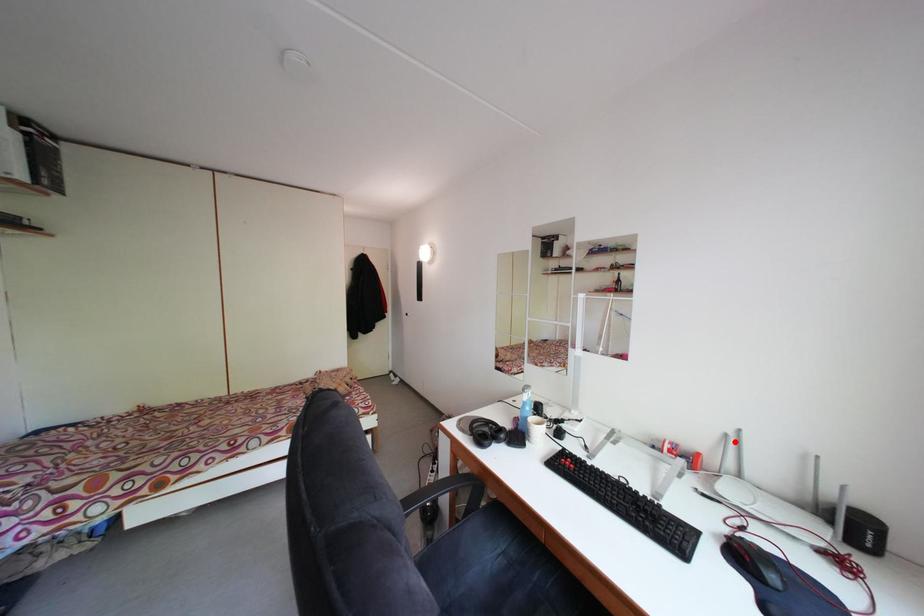
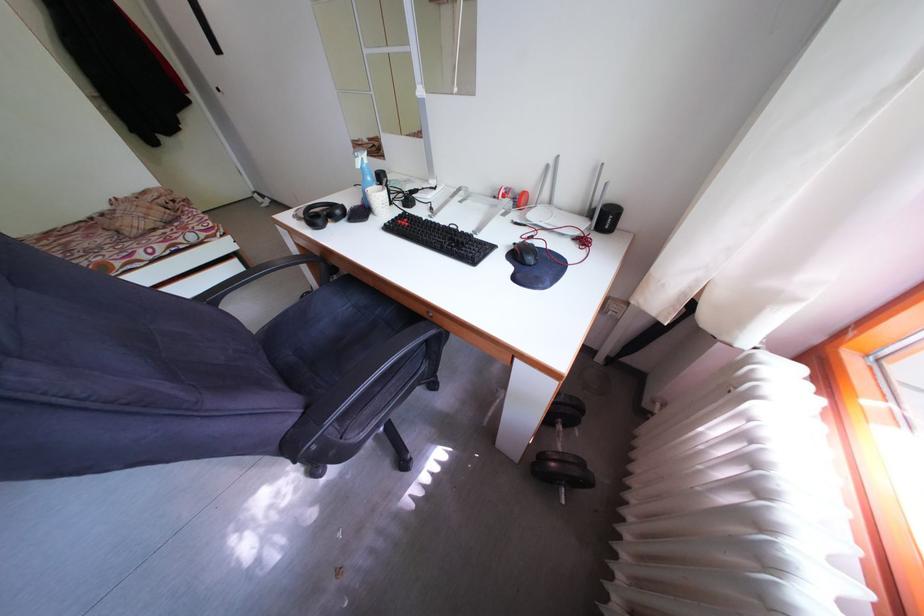
Question: I am providing you with two images of the same scene from different viewpoints. In image1, a red point is highlighted. Considering the same 3D point in image2, which of the following is correct?

Choices:
 (A) It is closer
 (B) It is farther

Answer: (A)